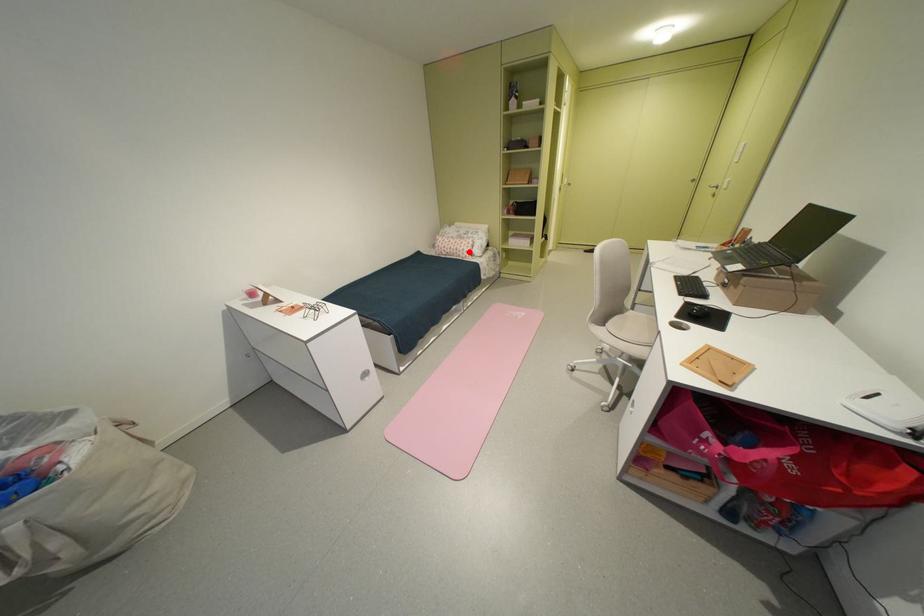
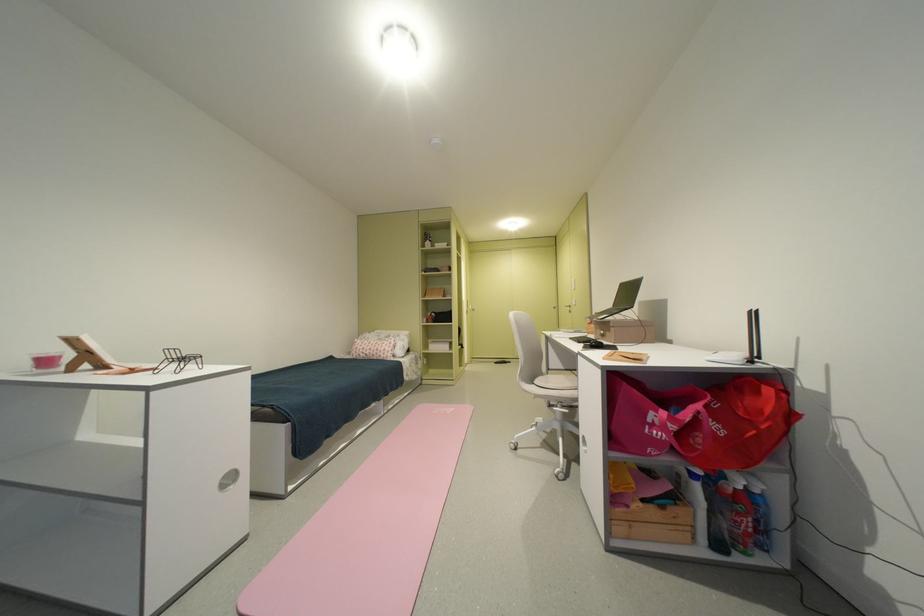
Locate, in the second image, the point that corresponds to the highlighted location in the first image.

(390, 352)